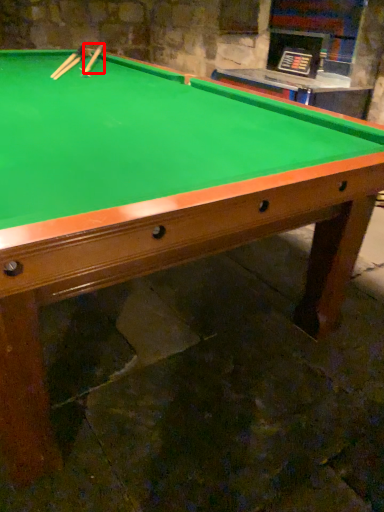
Question: From the image's perspective, what is the correct spatial relationship of cue (annotated by the red box) in relation to cue?

Choices:
 (A) below
 (B) above

Answer: (B)